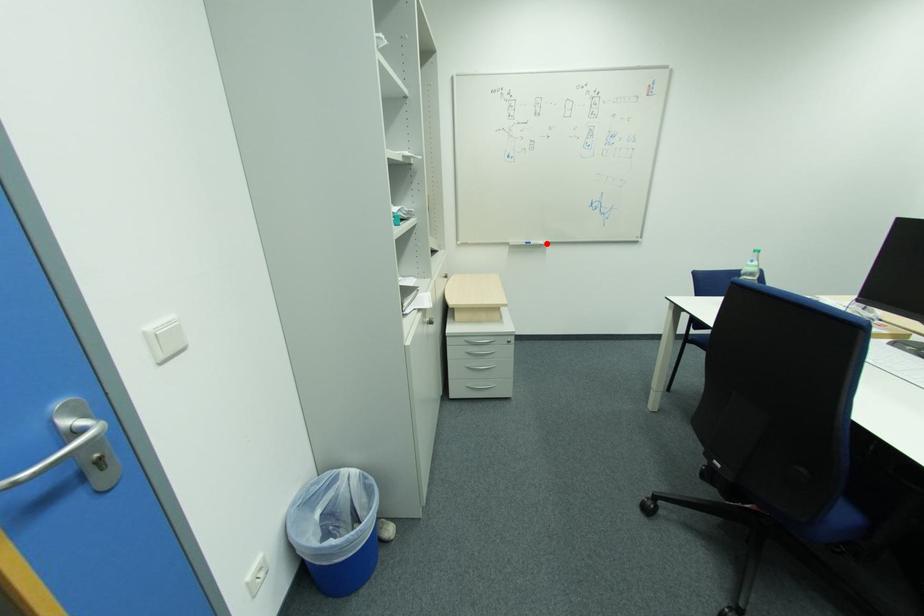
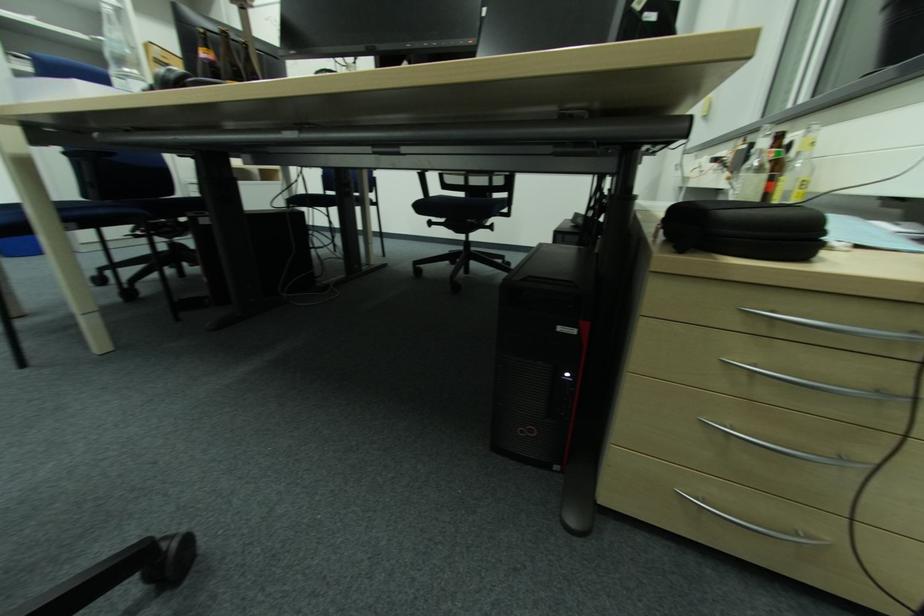
Question: I am providing you with two images of the same scene from different viewpoints. A red point is marked on the first image. Can you still see the location of the red point in image 2?

Choices:
 (A) Yes
 (B) No

Answer: (B)